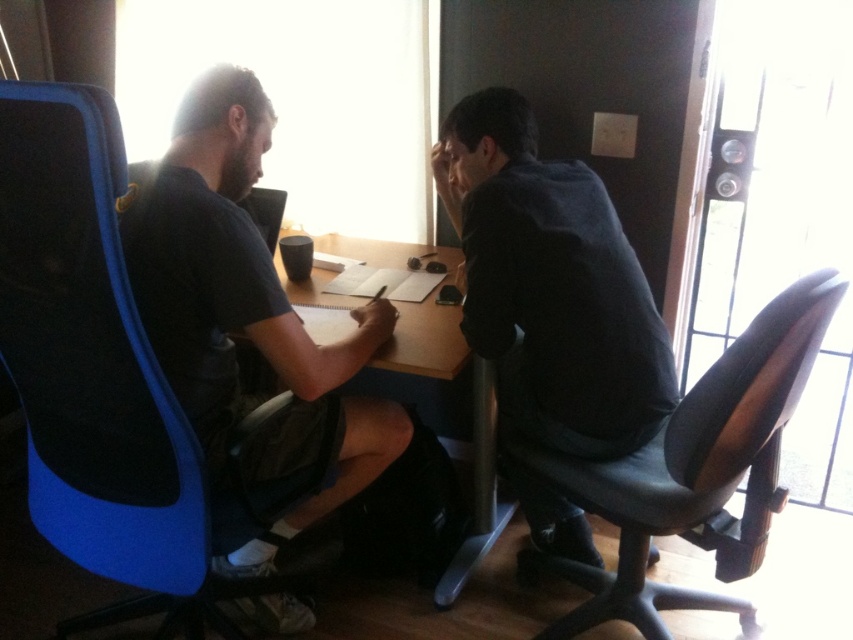
Question: Is blue fabric chair at left below black leather swivel chair at right?

Choices:
 (A) no
 (B) yes

Answer: (A)

Question: Which object is the farthest from the wooden table at center?

Choices:
 (A) blue fabric chair at left
 (B) matte black t-shirt at left

Answer: (A)

Question: Does blue fabric chair at left have a smaller size compared to black leather swivel chair at right?

Choices:
 (A) no
 (B) yes

Answer: (B)

Question: Which object appears closest to the camera in this image?

Choices:
 (A) blue fabric chair at left
 (B) dark gray shirt at right

Answer: (A)

Question: Which object is positioned farthest from the dark gray shirt at right?

Choices:
 (A) matte black t-shirt at left
 (B) wooden table at center
 (C) black leather swivel chair at right
 (D) blue fabric chair at left

Answer: (D)

Question: Is blue fabric chair at left bigger than matte black t-shirt at left?

Choices:
 (A) no
 (B) yes

Answer: (A)